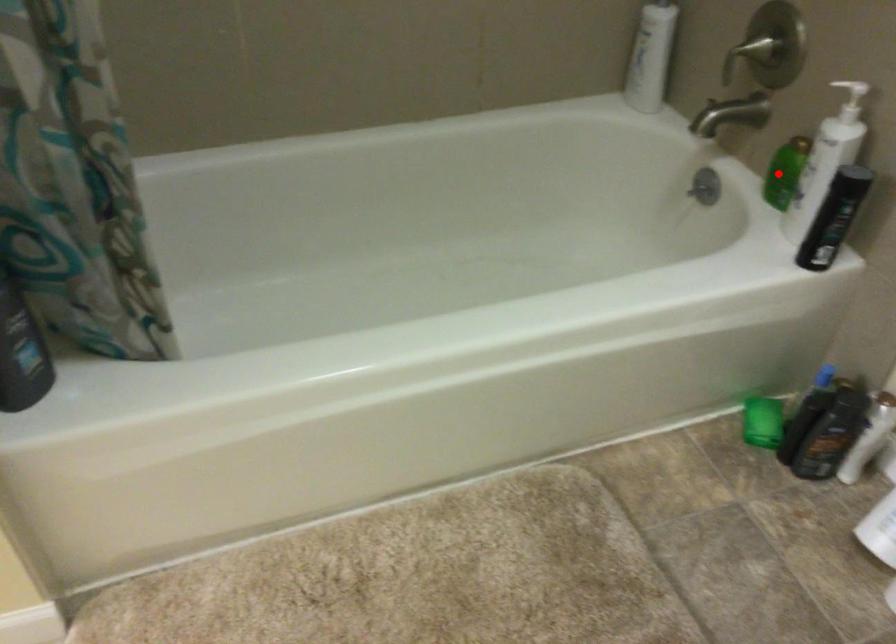
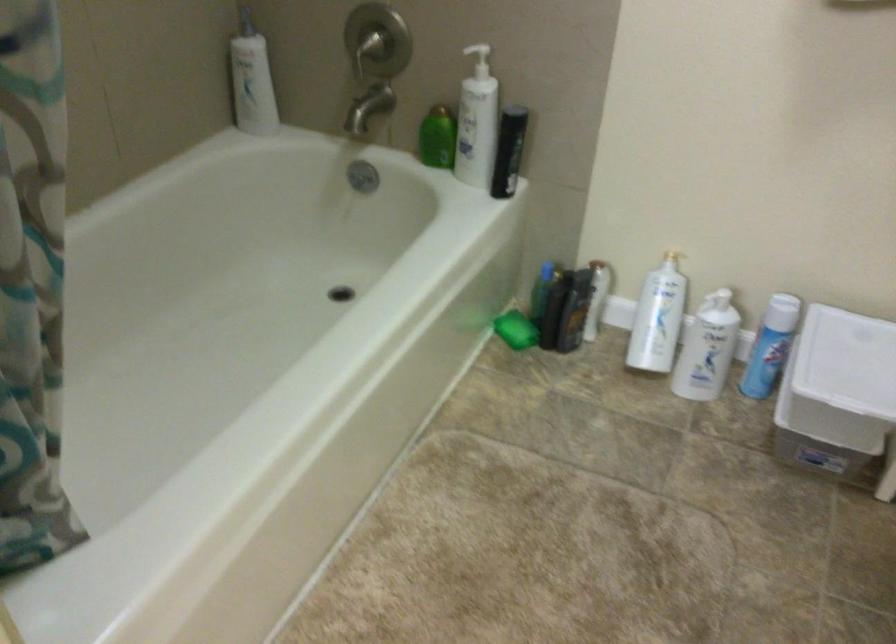
Question: I am providing you with two images of the same scene from different viewpoints. A red point is shown in image1. For the corresponding object point in image2, is it positioned nearer or farther from the camera?

Choices:
 (A) Nearer
 (B) Farther

Answer: (B)